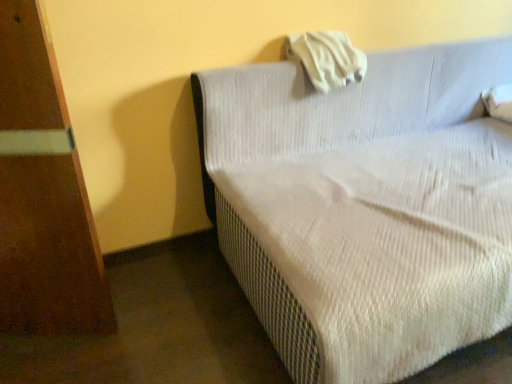
Question: Considering the relative sizes of white textured fabric couch at center and white fabric pillow at upper center in the image provided, is white textured fabric couch at center thinner than white fabric pillow at upper center?

Choices:
 (A) no
 (B) yes

Answer: (A)

Question: Is white textured fabric couch at center further to the viewer compared to white fabric pillow at upper center?

Choices:
 (A) yes
 (B) no

Answer: (B)

Question: From a real-world perspective, is white textured fabric couch at center physically above white fabric pillow at upper center?

Choices:
 (A) no
 (B) yes

Answer: (A)

Question: Can you confirm if white textured fabric couch at center is wider than white fabric pillow at upper center?

Choices:
 (A) yes
 (B) no

Answer: (A)

Question: Is white textured fabric couch at center oriented towards white fabric pillow at upper center?

Choices:
 (A) yes
 (B) no

Answer: (B)

Question: Is white textured fabric couch at center taller than white fabric pillow at upper center?

Choices:
 (A) no
 (B) yes

Answer: (B)

Question: Can we say white fabric pillow at upper center lies outside white textured fabric couch at center?

Choices:
 (A) no
 (B) yes

Answer: (A)

Question: Is white textured fabric couch at center a part of white fabric pillow at upper center?

Choices:
 (A) no
 (B) yes

Answer: (A)

Question: Does white fabric pillow at upper center have a greater height compared to white textured fabric couch at center?

Choices:
 (A) no
 (B) yes

Answer: (A)

Question: Can you confirm if white fabric pillow at upper center is wider than white textured fabric couch at center?

Choices:
 (A) no
 (B) yes

Answer: (A)

Question: Would you consider white fabric pillow at upper center to be distant from white textured fabric couch at center?

Choices:
 (A) no
 (B) yes

Answer: (A)

Question: From a real-world perspective, does white fabric pillow at upper center stand above white textured fabric couch at center?

Choices:
 (A) no
 (B) yes

Answer: (B)

Question: Relative to white textured fabric couch at center, is white fabric pillow at upper center in front or behind?

Choices:
 (A) behind
 (B) front

Answer: (A)